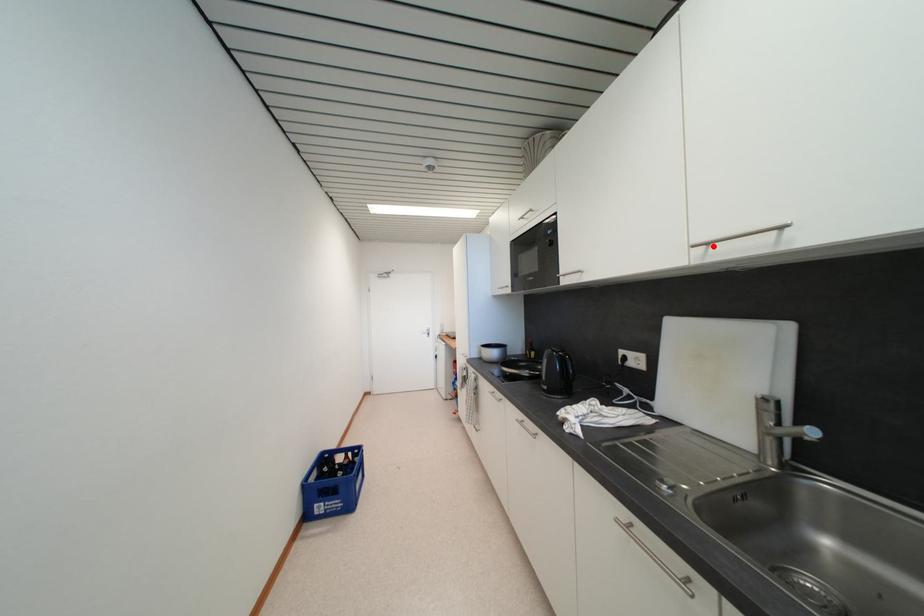
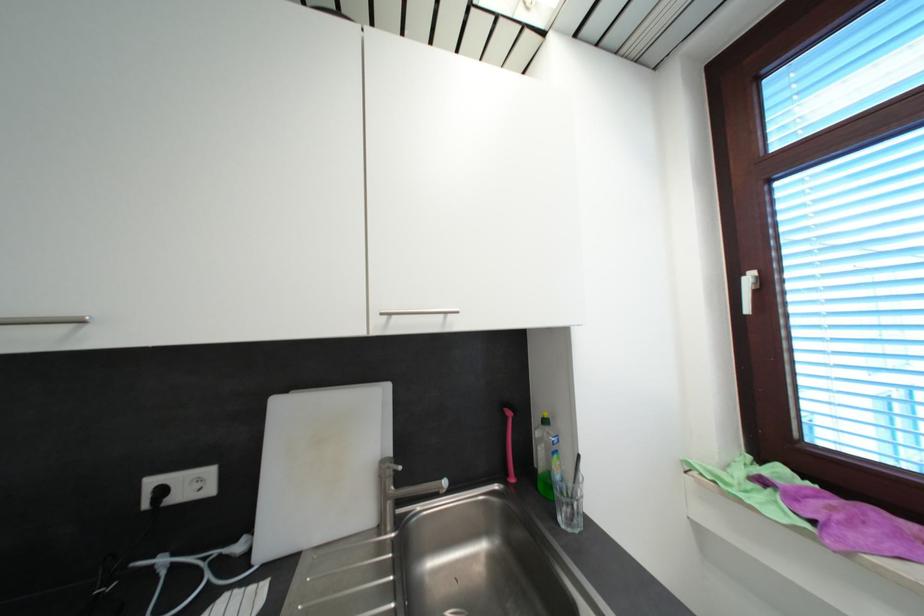
Find the pixel in the second image that matches the highlighted location in the first image.

(395, 315)